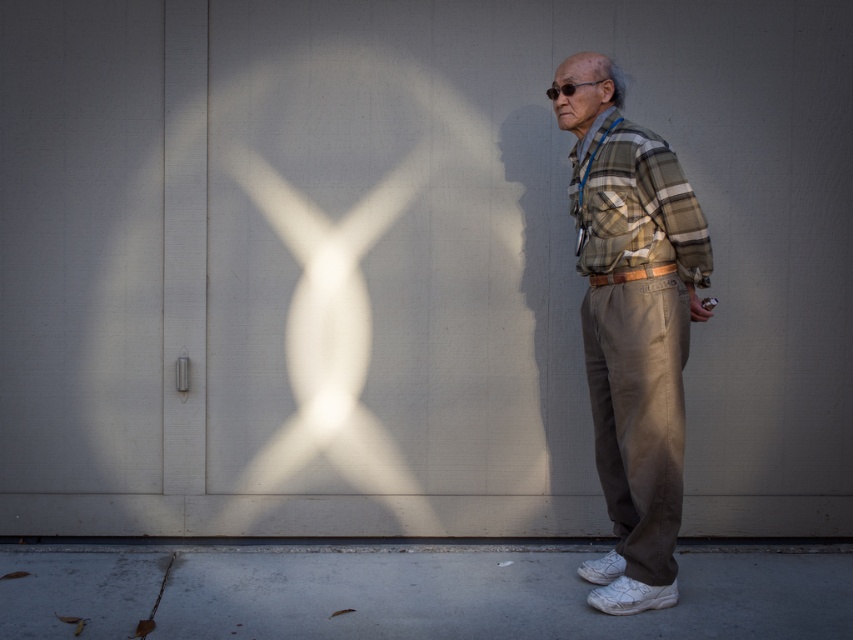
Consider the image. You are a photographer setting up a shoot in the scene described. You need to place a small tripod between the plaid fabric shirt at center and the matte brown wallet at lower right. Considering their positions, where should the tripod be placed?

The plaid fabric shirt at center is taller than the matte brown wallet at lower right, so the tripod should be placed between them at a position closer to the wallet to account for the height difference.

You are a photographer setting up a shoot for a fashion magazine. You have to place a matte brown wallet at lower right in the scene. Considering the existing plaid fabric shirt at center, which object should be placed closer to the camera to maintain the size relationship shown in the image?

The plaid fabric shirt at center is larger in size than the matte brown wallet at lower right, so to maintain the size relationship, the plaid fabric shirt at center should be placed closer to the camera.